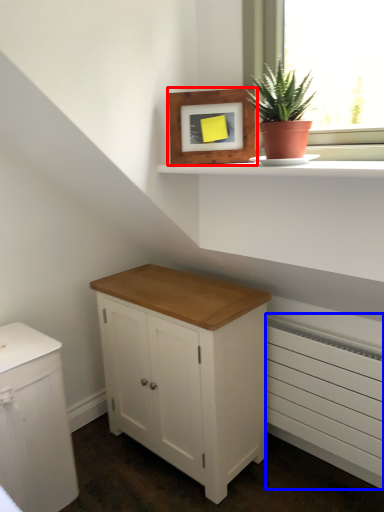
Question: Which object is further to the camera taking this photo, picture frame (highlighted by a red box) or radiator (highlighted by a blue box)?

Choices:
 (A) picture frame
 (B) radiator

Answer: (B)